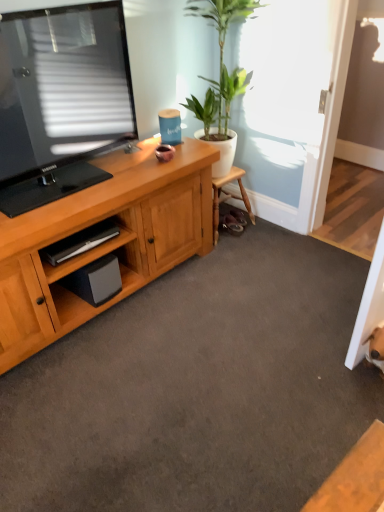
Describe the element at coordinates (95, 281) in the screenshot. This screenshot has height=512, width=384. I see `black matte speaker at lower left` at that location.

Measure the distance between point (x=210, y=23) and camera.

Point (x=210, y=23) is 7.83 feet from camera.

This screenshot has width=384, height=512. In order to click on wooden cabinet at lower left in this screenshot , I will do `click(83, 256)`.

Is black matte speaker at lower left behind green glossy plant at upper center?

That is True.

From the picture: From the image's perspective, between black matte speaker at lower left and green glossy plant at upper center, which one is located above?

From the image's view, green glossy plant at upper center is above.

Does black matte speaker at lower left appear on the right side of green glossy plant at upper center?

Incorrect, black matte speaker at lower left is not on the right side of green glossy plant at upper center.

Identify the location of speaker that is on the left side of green glossy plant at upper center. (95, 281).

Does black matte speaker at lower left have a lesser width compared to wooden cabinet at lower left?

No, black matte speaker at lower left is not thinner than wooden cabinet at lower left.

How many degrees apart are the facing directions of black matte speaker at lower left and wooden cabinet at lower left?

There is a 2.23-degree angle between the facing directions of black matte speaker at lower left and wooden cabinet at lower left.

Does black matte speaker at lower left have a lesser height compared to wooden cabinet at lower left?

Incorrect, the height of black matte speaker at lower left does not fall short of that of wooden cabinet at lower left.

Image resolution: width=384 pixels, height=512 pixels. Identify the location of cabinet above the black matte speaker at lower left (from the image's perspective). (83, 256).

Is wooden cabinet at lower left with green glossy plant at upper center?

No, wooden cabinet at lower left is not touching green glossy plant at upper center.

Is wooden cabinet at lower left looking in the opposite direction of green glossy plant at upper center?

That's not correct — wooden cabinet at lower left is not looking away from green glossy plant at upper center.

Considering the positions of points (105, 248) and (249, 12), is point (105, 248) closer to camera compared to point (249, 12)?

Yes, point (105, 248) is closer to viewer.

Considering the sizes of objects wooden cabinet at lower left and green glossy plant at upper center in the image provided, who is taller, wooden cabinet at lower left or green glossy plant at upper center?

Standing taller between the two is green glossy plant at upper center.

Based on the photo, does green glossy plant at upper center lie in front of wooden cabinet at lower left?

No, the depth of green glossy plant at upper center is greater than that of wooden cabinet at lower left.

Could you tell me if green glossy plant at upper center is turned towards wooden cabinet at lower left?

No, green glossy plant at upper center is not facing towards wooden cabinet at lower left.

Is green glossy plant at upper center wider or thinner than wooden cabinet at lower left?

Considering their sizes, green glossy plant at upper center looks broader than wooden cabinet at lower left.

Which is correct: green glossy plant at upper center is inside wooden cabinet at lower left, or outside of it?

green glossy plant at upper center is not inside wooden cabinet at lower left, it's outside.

Between green glossy plant at upper center and black matte speaker at lower left, which one has larger size?

With larger size is green glossy plant at upper center.

Is green glossy plant at upper center oriented away from black matte speaker at lower left?

No, green glossy plant at upper center's orientation is not away from black matte speaker at lower left.

From a real-world perspective, is green glossy plant at upper center physically located above or below black matte speaker at lower left?

Clearly, from a real-world perspective, green glossy plant at upper center is above black matte speaker at lower left.

Which object is positioned more to the right, green glossy plant at upper center or black matte speaker at lower left?

Positioned to the right is green glossy plant at upper center.

From the picture: How many degrees apart are the facing directions of wooden cabinet at lower left and black matte speaker at lower left?

The facing directions of wooden cabinet at lower left and black matte speaker at lower left are 2.23 degrees apart.

From the image's perspective, between wooden cabinet at lower left and black matte speaker at lower left, which one is located above?

wooden cabinet at lower left is shown above in the image.

Does wooden cabinet at lower left have a smaller size compared to black matte speaker at lower left?

Indeed, wooden cabinet at lower left has a smaller size compared to black matte speaker at lower left.

Locate an element on the screen. cabinet on the left of black matte speaker at lower left is located at coordinates (83, 256).

Identify the location of speaker on the left of green glossy plant at upper center. The height and width of the screenshot is (512, 384). (95, 281).

The width and height of the screenshot is (384, 512). I want to click on cabinet lying above the black matte speaker at lower left (from the image's perspective), so click(x=83, y=256).

Looking at the image, which one is located closer to green glossy plant at upper center, black matte speaker at lower left or wooden cabinet at lower left?

wooden cabinet at lower left is positioned closer to the anchor green glossy plant at upper center.

When comparing their distances from black matte speaker at lower left, does wooden cabinet at lower left or green glossy plant at upper center seem further?

green glossy plant at upper center lies further to black matte speaker at lower left than the other object.

Consider the image. When comparing their distances from green glossy plant at upper center, does wooden cabinet at lower left or black matte speaker at lower left seem closer?

wooden cabinet at lower left lies closer to green glossy plant at upper center than the other object.

Which object lies further to the anchor point wooden cabinet at lower left, black matte speaker at lower left or green glossy plant at upper center?

Among the two, green glossy plant at upper center is located further to wooden cabinet at lower left.

Considering their positions, is green glossy plant at upper center positioned closer to black matte speaker at lower left than wooden cabinet at lower left?

wooden cabinet at lower left is positioned closer to the anchor black matte speaker at lower left.

Based on their spatial positions, is green glossy plant at upper center or black matte speaker at lower left closer to wooden cabinet at lower left?

black matte speaker at lower left is positioned closer to the anchor wooden cabinet at lower left.

What are the coordinates of `cabinet between green glossy plant at upper center and black matte speaker at lower left vertically` in the screenshot? It's located at (83, 256).